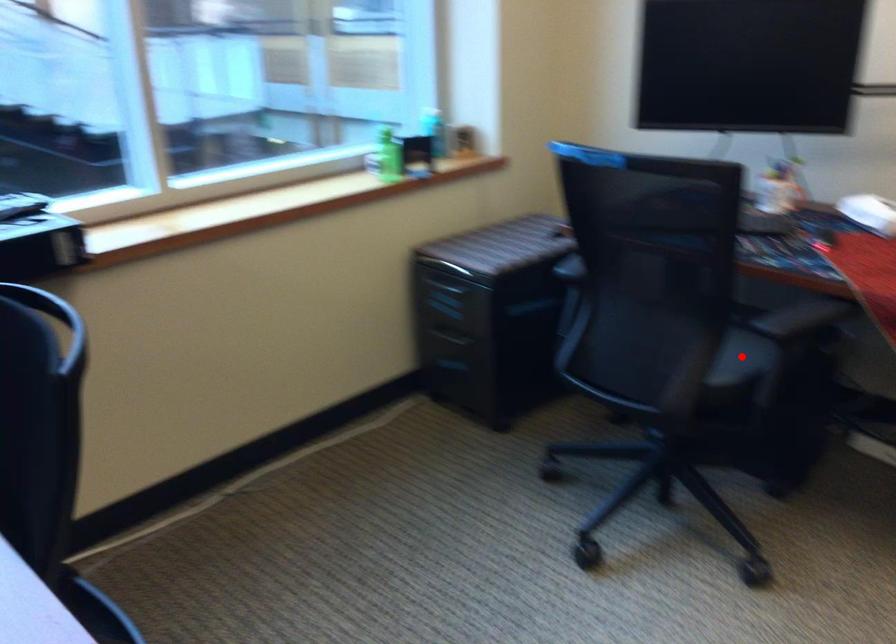
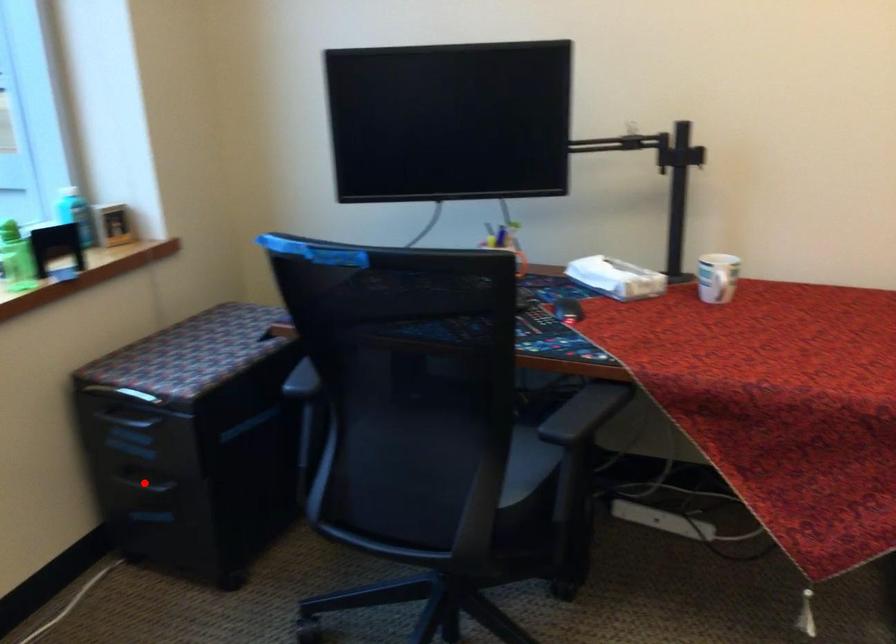
I am providing you with two images of the same scene from different viewpoints. A red point is marked on the first image and another point is marked on the second image. Do the highlighted points in image1 and image2 indicate the same real-world spot?

No